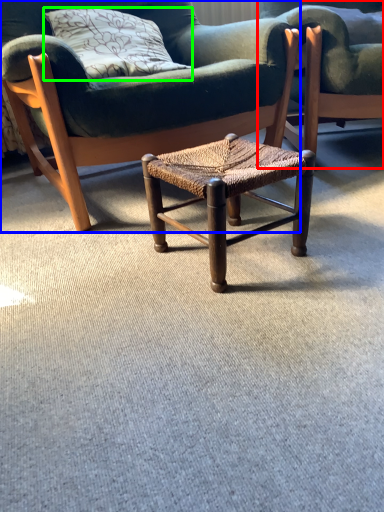
Question: Considering the real-world distances, which object is farthest from chair (highlighted by a red box)? chair (highlighted by a blue box) or pillow (highlighted by a green box)?

Choices:
 (A) chair
 (B) pillow

Answer: (B)